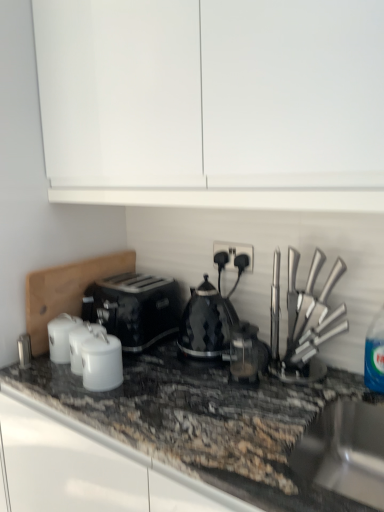
Question: Should I look upward or downward to see black diamond-patterned kettle at center, placed as the third kitchen appliance when sorted from left to right?

Choices:
 (A) up
 (B) down

Answer: (B)

Question: From the image's perspective, is black plastic socket at center beneath stainless steel sink at lower right?

Choices:
 (A) no
 (B) yes

Answer: (A)

Question: Considering the relative sizes of black plastic socket at center and stainless steel sink at lower right in the image provided, is black plastic socket at center taller than stainless steel sink at lower right?

Choices:
 (A) no
 (B) yes

Answer: (A)

Question: Is black plastic socket at center located outside stainless steel sink at lower right?

Choices:
 (A) yes
 (B) no

Answer: (A)

Question: From a real-world perspective, is black plastic socket at center physically below stainless steel sink at lower right?

Choices:
 (A) no
 (B) yes

Answer: (A)

Question: Is stainless steel sink at lower right a part of black plastic socket at center?

Choices:
 (A) no
 (B) yes

Answer: (A)

Question: Is black plastic socket at center bigger than stainless steel sink at lower right?

Choices:
 (A) yes
 (B) no

Answer: (B)

Question: Is black diamond-patterned kettle at center, placed as the 2th kitchen appliance when sorted from right to left, shorter than black plastic socket at center?

Choices:
 (A) yes
 (B) no

Answer: (B)

Question: Is black diamond-patterned kettle at center, placed as the third kitchen appliance when sorted from left to right, further to camera compared to black plastic socket at center?

Choices:
 (A) no
 (B) yes

Answer: (A)

Question: Can you confirm if black diamond-patterned kettle at center, placed as the 2th kitchen appliance when sorted from right to left, is bigger than black plastic socket at center?

Choices:
 (A) yes
 (B) no

Answer: (A)

Question: Is black diamond-patterned kettle at center, placed as the 2th kitchen appliance when sorted from right to left, not inside black plastic socket at center?

Choices:
 (A) no
 (B) yes

Answer: (B)

Question: Is black plastic socket at center located within black diamond-patterned kettle at center, placed as the third kitchen appliance when sorted from left to right?

Choices:
 (A) no
 (B) yes

Answer: (A)

Question: Does black diamond-patterned kettle at center, placed as the 2th kitchen appliance when sorted from right to left, have a greater height compared to black plastic socket at center?

Choices:
 (A) yes
 (B) no

Answer: (A)

Question: From the image's perspective, does white glossy canisters at center, the 1th kitchen appliance in the left-to-right sequence, appear lower than satin black coffee machine at center?

Choices:
 (A) yes
 (B) no

Answer: (A)